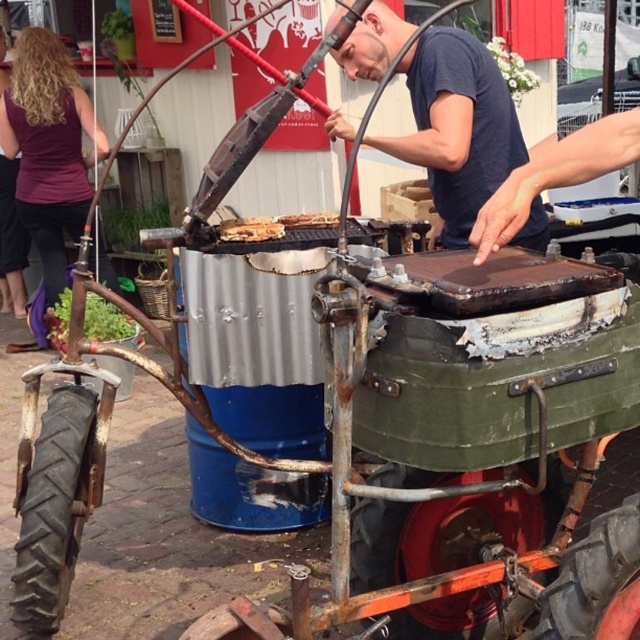
Is brown wooden plank at center further to the viewer compared to brown matte grill at center?

No, it is not.

Does brown wooden plank at center have a lesser width compared to brown matte grill at center?

Indeed, brown wooden plank at center has a lesser width compared to brown matte grill at center.

Locate an element on the screen. The height and width of the screenshot is (640, 640). brown wooden plank at center is located at coordinates (250, 228).

I want to click on brown wooden plank at center, so click(x=250, y=228).

Consider the image. Between dark blue shirt at center and brown wooden plank at center, which one appears on the right side from the viewer's perspective?

dark blue shirt at center is more to the right.

Is the position of dark blue shirt at center more distant than that of brown wooden plank at center?

No, dark blue shirt at center is in front of brown wooden plank at center.

Image resolution: width=640 pixels, height=640 pixels. Find the location of `dark blue shirt at center`. dark blue shirt at center is located at coordinates (456, 125).

Who is taller, dark blue shirt at center or purple fabric at left?

Standing taller between the two is purple fabric at left.

How much distance is there between dark blue shirt at center and purple fabric at left?

They are 3.16 meters apart.

Is point (376, 70) less distant than point (26, 122)?

Yes, point (376, 70) is closer to viewer.

Locate an element on the screen. The image size is (640, 640). dark blue shirt at center is located at coordinates (456, 125).